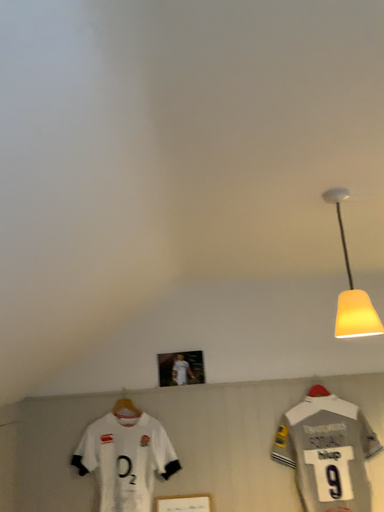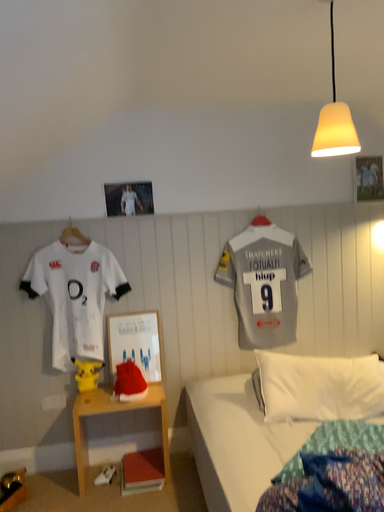
Question: How did the camera likely rotate when shooting the video?

Choices:
 (A) rotated upward
 (B) rotated downward

Answer: (B)